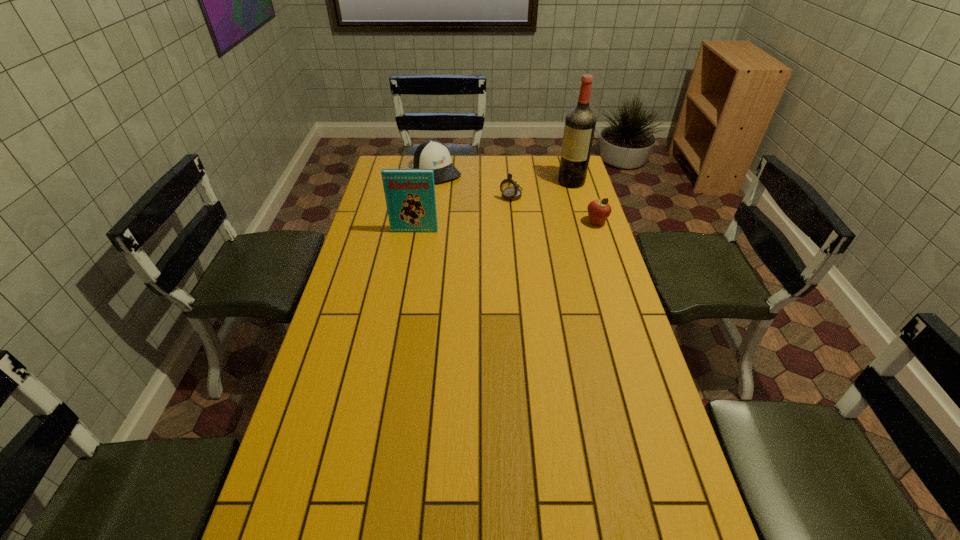
I want to click on vacant space located on the front-facing side of the liquor, so click(532, 212).

Find the location of a particular element. This screenshot has height=540, width=960. blank space located 0.380m on the front-facing side of the liquor is located at coordinates (511, 229).

The width and height of the screenshot is (960, 540). In order to click on free spot located 0.250m on the front-facing side of the liquor in this screenshot , I will do `click(531, 213)`.

At what (x,y) coordinates should I click in order to perform the action: click on free space located 0.300m on the front panel of the cap. Please return your answer as a coordinate pair (x, y). The height and width of the screenshot is (540, 960). Looking at the image, I should click on (481, 219).

What are the coordinates of `vacant space situated 0.150m on the front panel of the cap` in the screenshot? It's located at (463, 200).

Locate an element on the screen. free point located on the front panel of the cap is located at coordinates (470, 208).

In order to click on liquor located at the far edge in this screenshot , I will do `click(580, 122)`.

Locate an element on the screen. cap at the far edge is located at coordinates (432, 154).

Find the location of a particular element. The width and height of the screenshot is (960, 540). book situated at the left edge is located at coordinates (410, 197).

This screenshot has width=960, height=540. I want to click on cap that is at the left edge, so click(x=432, y=154).